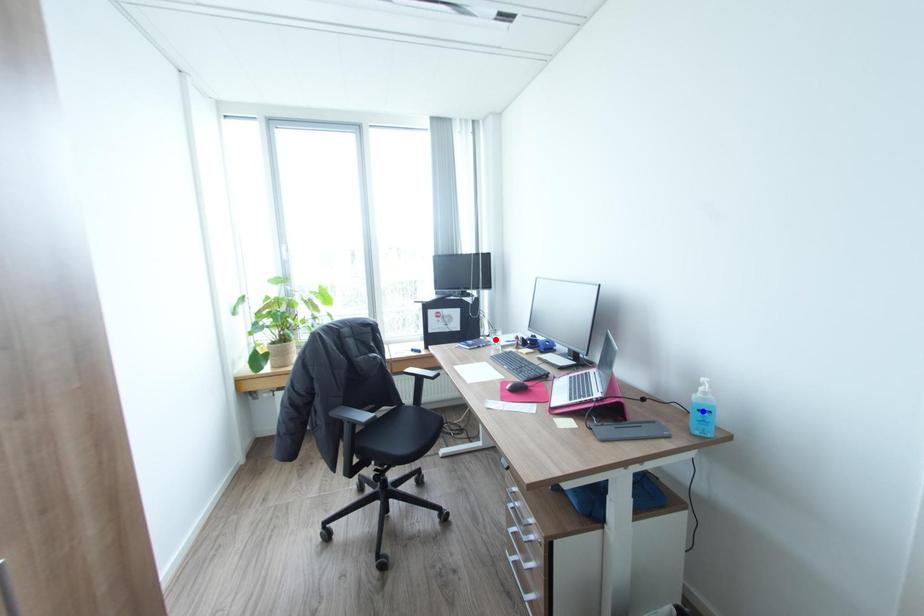
Question: Which of the two points in the image is closer to the camera?

Choices:
 (A) Blue point is closer.
 (B) Red point is closer.

Answer: (A)